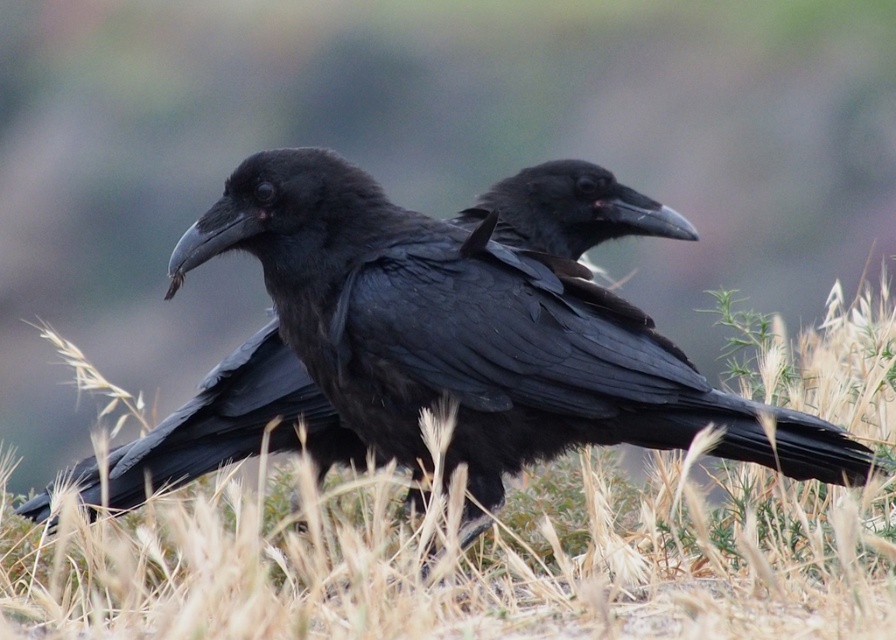
Can you confirm if dry grass at center is bigger than shiny black raven at center?

Correct, dry grass at center is larger in size than shiny black raven at center.

Is point (539, 576) farther from camera compared to point (119, 486)?

That is True.

At what (x,y) coordinates should I click in order to perform the action: click on dry grass at center. Please return your answer as a coordinate pair (x, y). This screenshot has width=896, height=640. Looking at the image, I should click on (467, 560).